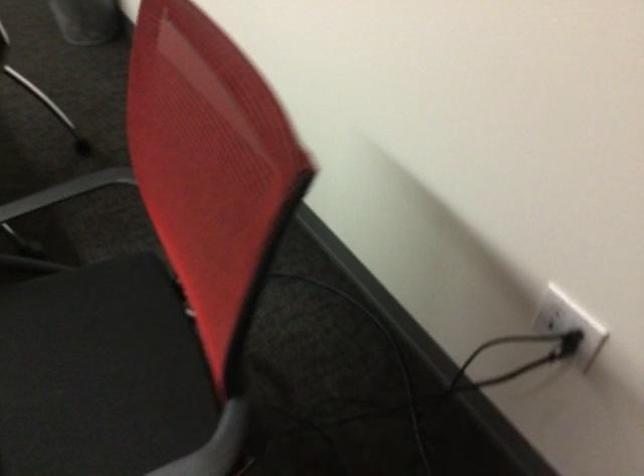
Locate an element on the screen. Image resolution: width=644 pixels, height=476 pixels. black power plug is located at coordinates (554, 312).